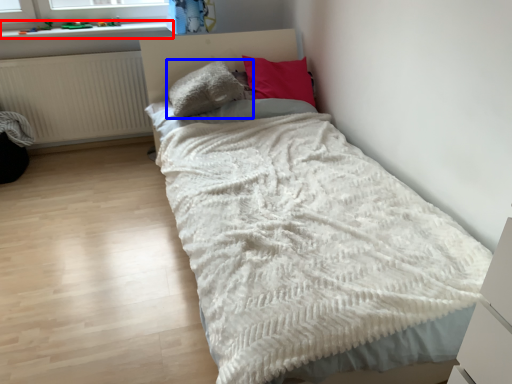
Question: Which point is closer to the camera, window sill (highlighted by a red box) or pillow (highlighted by a blue box)?

Choices:
 (A) window sill
 (B) pillow

Answer: (B)